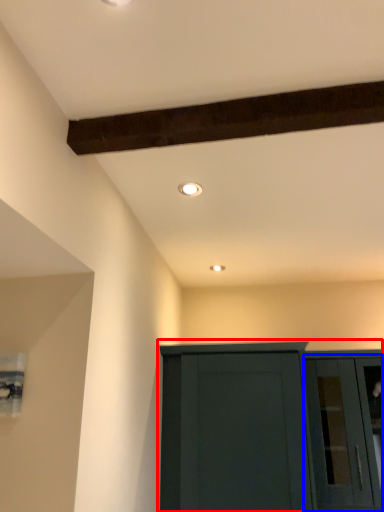
Question: Among these objects, which one is farthest to the camera, cupboard (highlighted by a red box) or glass door (highlighted by a blue box)?

Choices:
 (A) cupboard
 (B) glass door

Answer: (B)